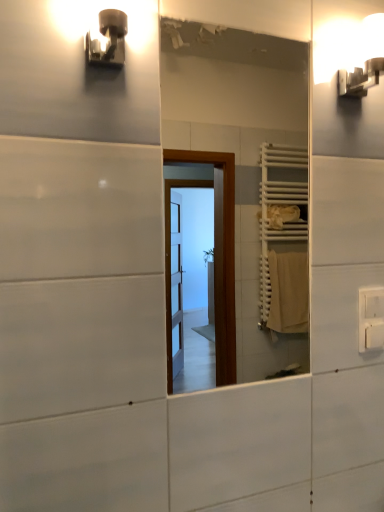
Question: Does metallic wall sconce at upper left, the second light fixture positioned from the right, have a smaller size compared to white plastic electric outlet at upper right?

Choices:
 (A) no
 (B) yes

Answer: (A)

Question: Is metallic wall sconce at upper left, the second light fixture positioned from the right, thinner than white plastic electric outlet at upper right?

Choices:
 (A) no
 (B) yes

Answer: (A)

Question: From a real-world perspective, is metallic wall sconce at upper left, the 1th light fixture viewed from the front, under white plastic electric outlet at upper right?

Choices:
 (A) yes
 (B) no

Answer: (B)

Question: From the image's perspective, does metallic wall sconce at upper left, which is the 2th light fixture from back to front, appear lower than white plastic electric outlet at upper right?

Choices:
 (A) no
 (B) yes

Answer: (A)

Question: Is there a large distance between metallic wall sconce at upper left, which is the 2th light fixture from back to front, and white plastic electric outlet at upper right?

Choices:
 (A) no
 (B) yes

Answer: (A)

Question: From the image's perspective, relative to metallic wall sconce at upper left, which appears as the first light fixture when viewed from the left, is white glossy wall sconce at upper right, acting as the second light fixture starting from the front, above or below?

Choices:
 (A) above
 (B) below

Answer: (A)

Question: Is white glossy wall sconce at upper right, arranged as the 1th light fixture when viewed from the back, spatially inside metallic wall sconce at upper left, which appears as the first light fixture when viewed from the left, or outside of it?

Choices:
 (A) inside
 (B) outside

Answer: (B)

Question: Is white glossy wall sconce at upper right, acting as the 1th light fixture starting from the right, wider or thinner than metallic wall sconce at upper left, the second light fixture positioned from the right?

Choices:
 (A) thin
 (B) wide

Answer: (B)

Question: Does point (367, 70) appear closer or farther from the camera than point (112, 39)?

Choices:
 (A) closer
 (B) farther

Answer: (B)

Question: Considering the positions of white glossy mirror at center and metallic wall sconce at upper left, the second light fixture positioned from the right, in the image, is white glossy mirror at center wider or thinner than metallic wall sconce at upper left, the second light fixture positioned from the right,?

Choices:
 (A) wide
 (B) thin

Answer: (B)

Question: In terms of height, does white glossy mirror at center look taller or shorter compared to metallic wall sconce at upper left, the 1th light fixture viewed from the front?

Choices:
 (A) tall
 (B) short

Answer: (A)

Question: In the image, is white glossy mirror at center positioned in front of or behind metallic wall sconce at upper left, the 1th light fixture viewed from the front?

Choices:
 (A) front
 (B) behind

Answer: (B)

Question: From the image's perspective, is white glossy mirror at center above or below metallic wall sconce at upper left, the 1th light fixture viewed from the front?

Choices:
 (A) above
 (B) below

Answer: (B)

Question: Is metallic wall sconce at upper left, which is the 2th light fixture from back to front, wider or thinner than white plastic electric outlet at upper right?

Choices:
 (A) wide
 (B) thin

Answer: (A)

Question: Is metallic wall sconce at upper left, which is the 2th light fixture from back to front, bigger or smaller than white plastic electric outlet at upper right?

Choices:
 (A) small
 (B) big

Answer: (B)